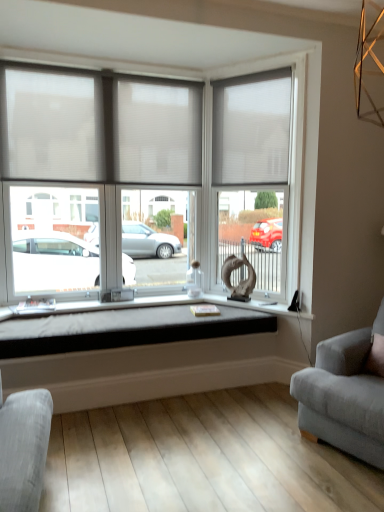
Describe the element at coordinates (251, 129) in the screenshot. The height and width of the screenshot is (512, 384). I see `white fabric window blind at upper right, the 2th window blind when ordered from left to right` at that location.

At what (x,y) coordinates should I click in order to perform the action: click on white sheer blinds at upper left, arranged as the second window blind when viewed from the right. Please return your answer as a coordinate pair (x, y). This screenshot has height=512, width=384. Looking at the image, I should click on (99, 127).

The width and height of the screenshot is (384, 512). Identify the location of matte glass door at center. click(x=254, y=172).

Is translucent fabric window at center aimed at soft gray fabric couch at right?

No.

From the picture: Is translucent fabric window at center thinner than soft gray fabric couch at right?

Correct, the width of translucent fabric window at center is less than that of soft gray fabric couch at right.

From the image's perspective, which is above, translucent fabric window at center or soft gray fabric couch at right?

translucent fabric window at center.

From a real-world perspective, is translucent fabric window at center physically above soft gray fabric couch at right?

Correct, in the physical world, translucent fabric window at center is higher than soft gray fabric couch at right.

Is black fabric cushion at center oriented away from white sheer blinds at upper left, arranged as the second window blind when viewed from the right?

No.

Which of these two, black fabric cushion at center or white sheer blinds at upper left, the 1th window blind from the left, is wider?

black fabric cushion at center.

Is black fabric cushion at center next to white sheer blinds at upper left, the 1th window blind from the left?

No, black fabric cushion at center is not next to white sheer blinds at upper left, the 1th window blind from the left.

Considering the sizes of objects black fabric cushion at center and white sheer blinds at upper left, the 1th window blind from the left, in the image provided, who is smaller, black fabric cushion at center or white sheer blinds at upper left, the 1th window blind from the left,?

black fabric cushion at center.

The width and height of the screenshot is (384, 512). In order to click on window blind below the white fabric window blind at upper right, the 2th window blind when ordered from left to right (from the image's perspective) in this screenshot , I will do `click(99, 127)`.

Is the position of white fabric window blind at upper right, the 2th window blind when ordered from left to right, more distant than that of white sheer blinds at upper left, the 1th window blind from the left?

Yes, white fabric window blind at upper right, the 2th window blind when ordered from left to right, is behind white sheer blinds at upper left, the 1th window blind from the left.

Could you tell me if white fabric window blind at upper right, the 2th window blind when ordered from left to right, is facing white sheer blinds at upper left, the 1th window blind from the left?

No, white fabric window blind at upper right, the 2th window blind when ordered from left to right, does not turn towards white sheer blinds at upper left, the 1th window blind from the left.

How much distance is there between white fabric window blind at upper right, which is the 1th window blind in right-to-left order, and white sheer blinds at upper left, arranged as the second window blind when viewed from the right?

white fabric window blind at upper right, which is the 1th window blind in right-to-left order, is 29.75 inches from white sheer blinds at upper left, arranged as the second window blind when viewed from the right.

Does point (336, 337) come behind point (282, 116)?

No, (336, 337) is closer to viewer.

From the image's perspective, which object appears higher, soft gray fabric couch at right or matte glass door at center?

matte glass door at center is shown above in the image.

Considering the relative sizes of soft gray fabric couch at right and matte glass door at center in the image provided, is soft gray fabric couch at right bigger than matte glass door at center?

Yes.

In terms of height, does soft gray fabric couch at right look taller or shorter compared to black fabric cushion at center?

soft gray fabric couch at right is taller than black fabric cushion at center.

Considering the positions of objects soft gray fabric couch at right and black fabric cushion at center in the image provided, who is behind, soft gray fabric couch at right or black fabric cushion at center?

black fabric cushion at center is further from the camera.

Considering the positions of objects soft gray fabric couch at right and black fabric cushion at center in the image provided, who is more to the left, soft gray fabric couch at right or black fabric cushion at center?

Positioned to the left is black fabric cushion at center.

From the image's perspective, is translucent fabric window at center beneath white sheer blinds at upper left, the 1th window blind from the left?

Yes.

Is translucent fabric window at center further to camera compared to white sheer blinds at upper left, the 1th window blind from the left?

No, it is in front of white sheer blinds at upper left, the 1th window blind from the left.

Is translucent fabric window at center smaller than white sheer blinds at upper left, arranged as the second window blind when viewed from the right?

No.

Between translucent fabric window at center and white sheer blinds at upper left, the 1th window blind from the left, which one has more height?

translucent fabric window at center.

Considering the positions of points (226, 104) and (352, 440), is point (226, 104) farther from camera compared to point (352, 440)?

Yes, it is behind point (352, 440).

How different are the orientations of matte glass door at center and soft gray fabric couch at right in degrees?

There is a 15.5-degree angle between the facing directions of matte glass door at center and soft gray fabric couch at right.

Does matte glass door at center have a smaller size compared to soft gray fabric couch at right?

Yes.

Locate an element on the screen. studio couch that is on the right side of translucent fabric window at center is located at coordinates (346, 393).

This screenshot has width=384, height=512. Find the location of `window blind on the left side of black fabric cushion at center`. window blind on the left side of black fabric cushion at center is located at coordinates (99, 127).

Which object lies nearer to the anchor point translucent fabric window at center, black fabric cushion at center or white sheer blinds at upper left, arranged as the second window blind when viewed from the right?

white sheer blinds at upper left, arranged as the second window blind when viewed from the right.

Based on their spatial positions, is black fabric cushion at center or white fabric window blind at upper right, which is the 1th window blind in right-to-left order, further from translucent fabric window at center?

The object further to translucent fabric window at center is black fabric cushion at center.

When comparing their distances from translucent fabric window at center, does soft gray fabric couch at right or black fabric cushion at center seem further?

Based on the image, soft gray fabric couch at right appears to be further to translucent fabric window at center.

Considering their positions, is matte glass door at center positioned further to soft gray fabric couch at right than white sheer blinds at upper left, arranged as the second window blind when viewed from the right?

white sheer blinds at upper left, arranged as the second window blind when viewed from the right, is positioned further to the anchor soft gray fabric couch at right.

Based on their spatial positions, is black fabric cushion at center or soft gray fabric couch at right further from white fabric window blind at upper right, the 2th window blind when ordered from left to right?

soft gray fabric couch at right is further to white fabric window blind at upper right, the 2th window blind when ordered from left to right.

Which object lies further to the anchor point soft gray fabric couch at right, translucent fabric window at center or black fabric cushion at center?

The object further to soft gray fabric couch at right is translucent fabric window at center.

Estimate the real-world distances between objects in this image. Which object is closer to black fabric cushion at center, matte glass door at center or white fabric window blind at upper right, the 2th window blind when ordered from left to right?

The object closer to black fabric cushion at center is matte glass door at center.

Estimate the real-world distances between objects in this image. Which object is further from translucent fabric window at center, white sheer blinds at upper left, the 1th window blind from the left, or white fabric window blind at upper right, the 2th window blind when ordered from left to right?

white fabric window blind at upper right, the 2th window blind when ordered from left to right.

The height and width of the screenshot is (512, 384). Identify the location of glass door between white fabric window blind at upper right, the 2th window blind when ordered from left to right, and soft gray fabric couch at right vertically. (254, 172).

Where is `window between matte glass door at center and black fabric cushion at center in the vertical direction`? The image size is (384, 512). window between matte glass door at center and black fabric cushion at center in the vertical direction is located at coordinates (288, 160).

The height and width of the screenshot is (512, 384). I want to click on glass door between white sheer blinds at upper left, the 1th window blind from the left, and black fabric cushion at center in the up-down direction, so click(x=254, y=172).

The height and width of the screenshot is (512, 384). What are the coordinates of `window between white sheer blinds at upper left, arranged as the second window blind when viewed from the right, and black fabric cushion at center in the up-down direction` in the screenshot? It's located at (288, 160).